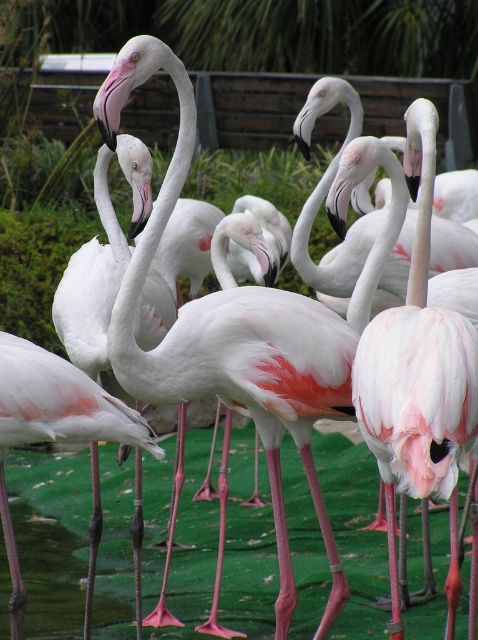
Does point (424, 340) come farther from viewer compared to point (8, 388)?

No, (424, 340) is closer to viewer.

Between matte pink flamingo at center and pink matte flamingo at center, which one appears on the right side from the viewer's perspective?

Positioned to the right is matte pink flamingo at center.

Where is `matte pink flamingo at center`? The width and height of the screenshot is (478, 640). matte pink flamingo at center is located at coordinates (419, 378).